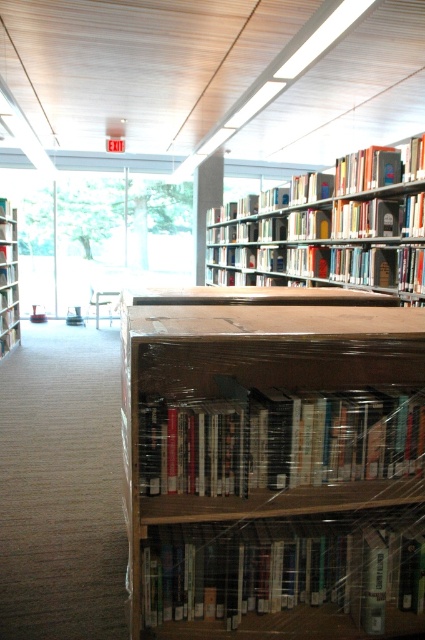
Consider the image. You are a librarian who needs to place a new book on the shelf. The new book is 3 meters long. You see the white glossy book at lower center and the hardcover book at upper center. Can you fit the new book between them?

The distance between the white glossy book at lower center and the hardcover book at upper center is 3.02 meters, so yes, the new book which is 3 meters long can fit between them.

You are standing in the library looking at the bookshelves. There are two points marked on the image, one at coordinate point (x=158, y=456) and the other at point (x=280, y=394). Which point is closer to you?

Point (x=158, y=456) is closer to the camera than point (x=280, y=394).

You are a librarian trying to place a book that is 1.7 meters long. You see two points marked as point [410,577]. Can you fit the book between them?

The distance between the two points is 1.73 meters, so the book can fit between them as it is slightly shorter than the available space.